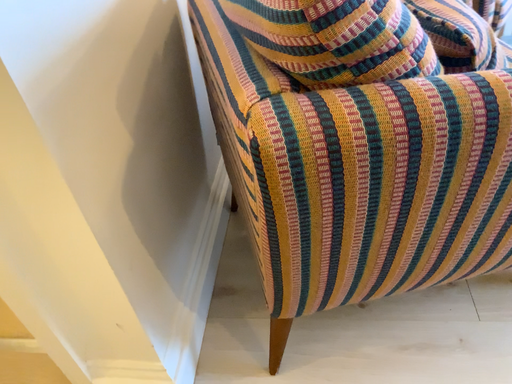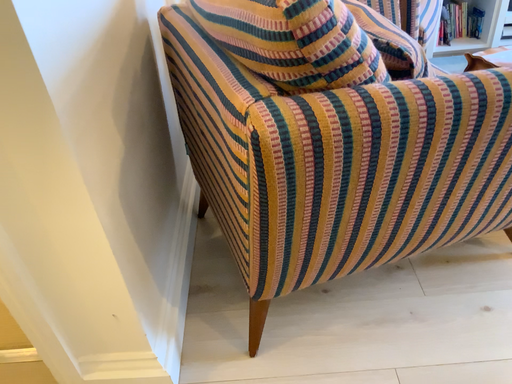
Question: How did the camera likely rotate when shooting the video?

Choices:
 (A) rotated left
 (B) rotated right

Answer: (B)